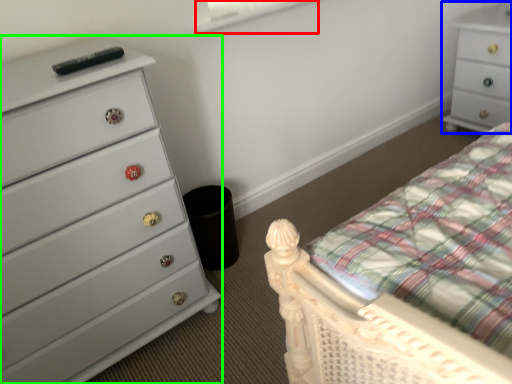
Question: Based on their relative distances, which object is nearer to window screen (highlighted by a red box)? Choose from chest of drawers (highlighted by a blue box) and chest of drawers (highlighted by a green box).

Choices:
 (A) chest of drawers
 (B) chest of drawers

Answer: (B)